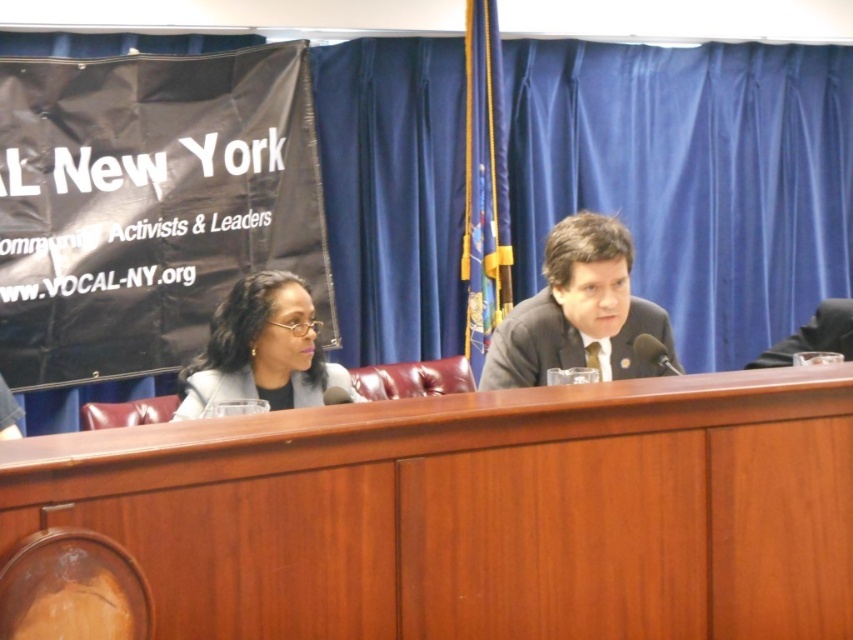
Question: Does wooden table at center lie in front of dark gray suit at center?

Choices:
 (A) yes
 (B) no

Answer: (A)

Question: Considering the relative positions of dark gray suit at center and matte black glasses at center in the image provided, where is dark gray suit at center located with respect to matte black glasses at center?

Choices:
 (A) below
 (B) above

Answer: (B)

Question: Does wooden table at center lie in front of matte black glasses at center?

Choices:
 (A) no
 (B) yes

Answer: (B)

Question: Among these points, which one is farthest from the camera?

Choices:
 (A) (186, 444)
 (B) (624, 298)

Answer: (B)

Question: Estimate the real-world distances between objects in this image. Which object is farther from the dark gray suit at center?

Choices:
 (A) wooden table at center
 (B) matte black glasses at center

Answer: (B)

Question: Which object is closer to the camera taking this photo?

Choices:
 (A) wooden table at center
 (B) matte black glasses at center
 (C) dark gray suit at center

Answer: (A)